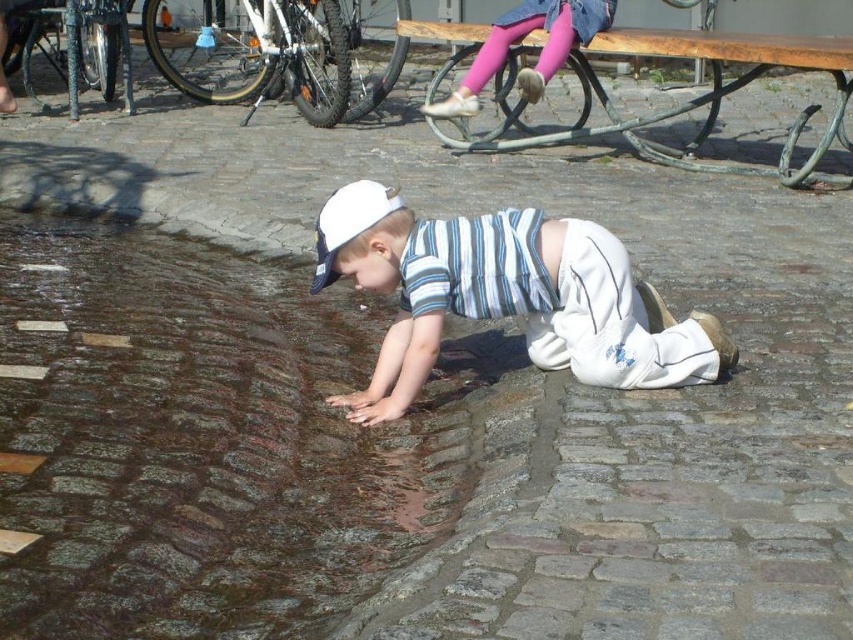
You are standing on the cobblestone street and see two points marked in the image. Which point is closer to you, point (218, 252) or point (439, 109)?

Point (218, 252) is closer to the viewer than point (439, 109).

You are standing in the cobblestone street scene. You see two points marked as point 1 at coordinates (373, 228) and point 2 at coordinates (556, 29). Which point is closer to you?

Point 1 at coordinates (373, 228) is closer to you than point 2 at coordinates (556, 29).